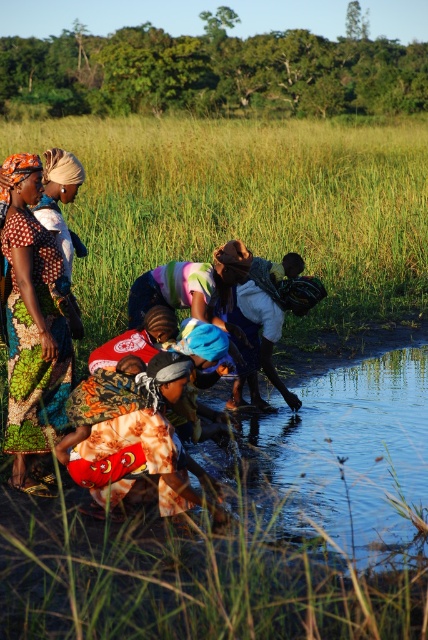
Is printed fabric dress at center further to the viewer compared to printed fabric child at lower center?

Yes, printed fabric dress at center is further from the viewer.

Does printed fabric dress at center appear on the left side of printed fabric child at lower center?

Indeed, printed fabric dress at center is positioned on the left side of printed fabric child at lower center.

Locate an element on the screen. The height and width of the screenshot is (640, 428). printed fabric dress at center is located at coordinates (32, 330).